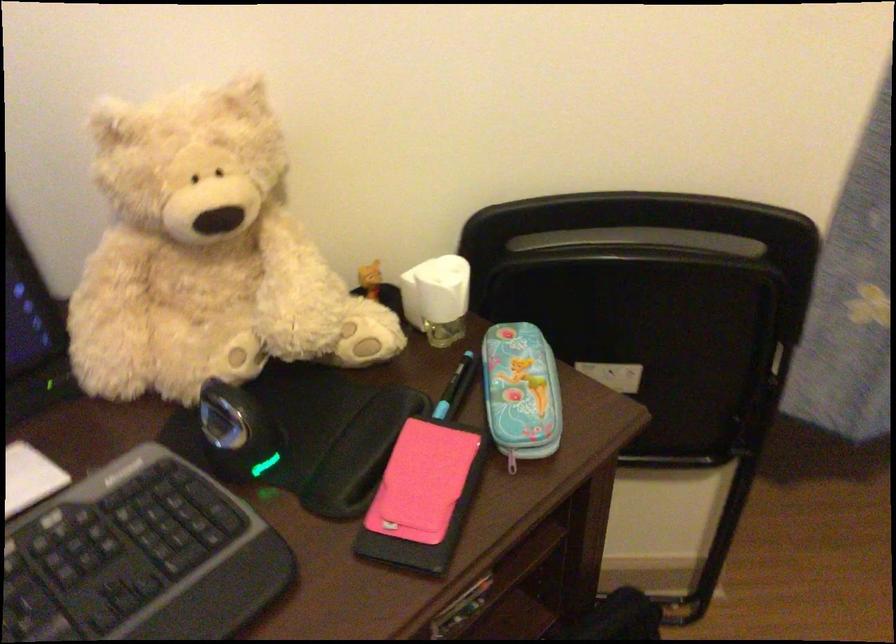
Which object does [437,298] point to?

It refers to a white air freshener.